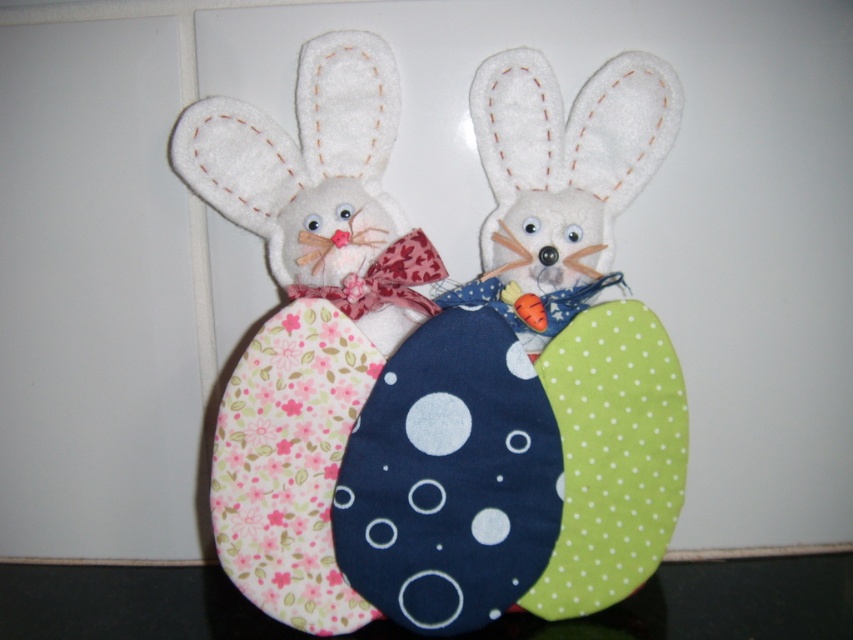
Is the position of fluffy fabric bunny at center less distant than that of fluffy white bunny at left?

Yes, fluffy fabric bunny at center is closer to the viewer.

Where is `fluffy fabric bunny at center`? fluffy fabric bunny at center is located at coordinates (440, 355).

Where is `fluffy fabric bunny at center`? fluffy fabric bunny at center is located at coordinates (440, 355).